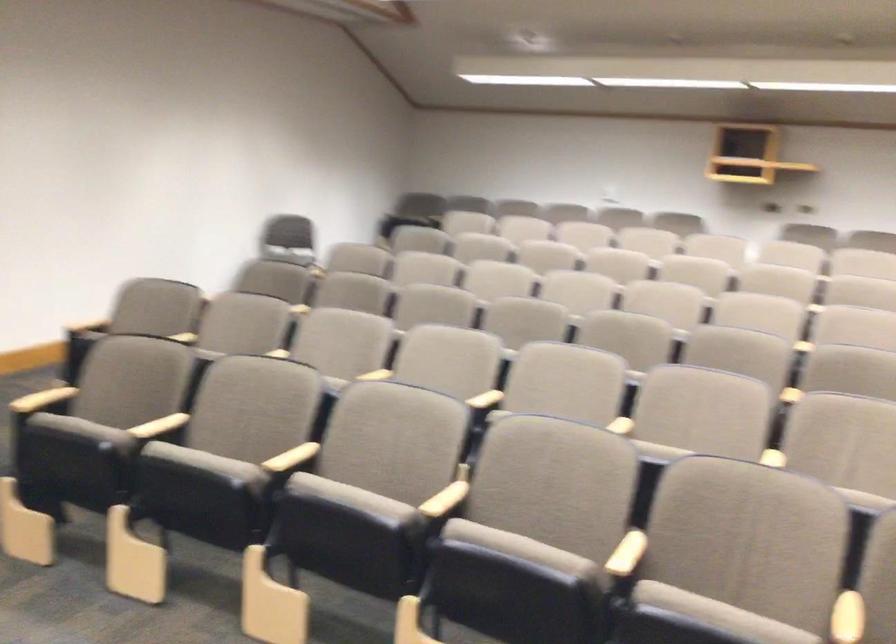
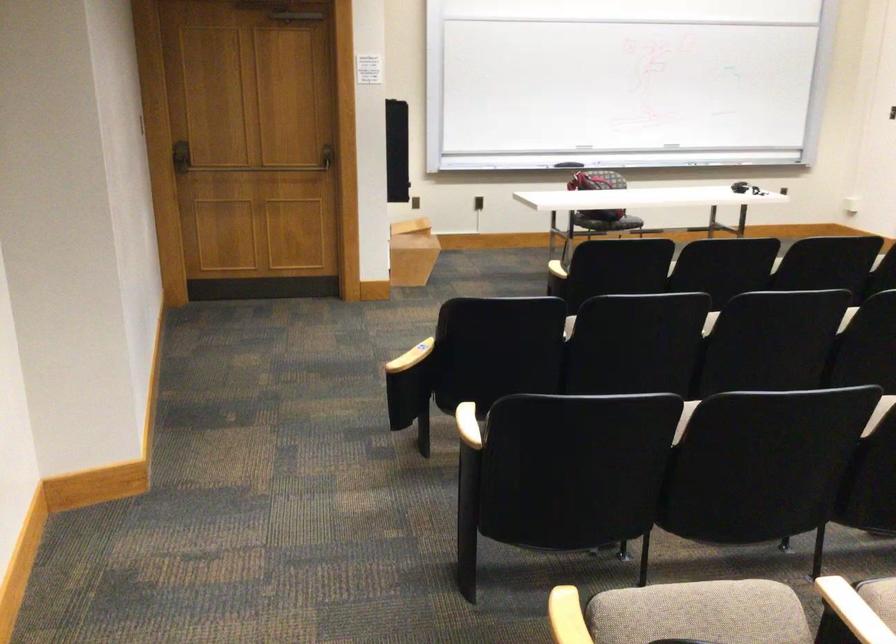
The first image is from the beginning of the video and the second image is from the end. How did the camera likely rotate when shooting the video?

The camera rotated toward right-down.